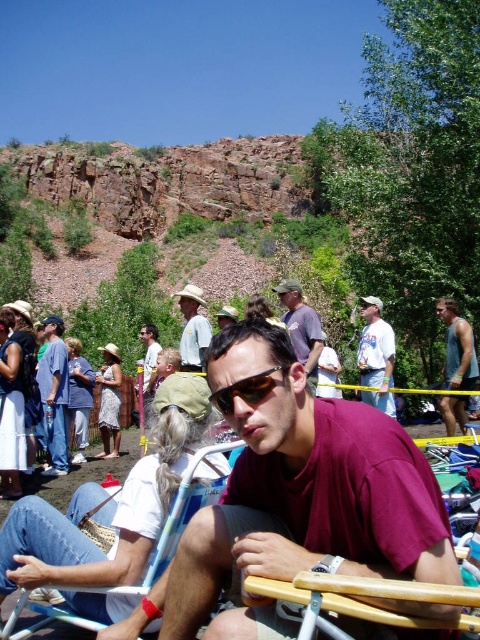
Between blue plastic beach chair at lower left and matte gray shirt at center, which one is positioned higher?

matte gray shirt at center

Is blue plastic beach chair at lower left taller than matte gray shirt at center?

Incorrect, blue plastic beach chair at lower left's height is not larger of matte gray shirt at center's.

Between point (233, 444) and point (292, 316), which one is positioned behind?

The point (292, 316) is more distant.

At what (x,y) coordinates should I click in order to perform the action: click on blue plastic beach chair at lower left. Please return your answer as a coordinate pair (x, y). The width and height of the screenshot is (480, 640). Looking at the image, I should click on (118, 586).

Consider the image. Is green tank top at right behind black plastic sunglasses at center?

Yes, green tank top at right is further from the viewer.

Between green tank top at right and black plastic sunglasses at center, which one appears on the right side from the viewer's perspective?

From the viewer's perspective, green tank top at right appears more on the right side.

Locate an element on the screen. green tank top at right is located at coordinates (457, 348).

Locate an element on the screen. This screenshot has width=480, height=640. green tank top at right is located at coordinates (457, 348).

Between maroon fabric shirt at center and matte brown hat at center, which one has more height?

With more height is maroon fabric shirt at center.

Is point (355, 416) positioned behind point (225, 317)?

No, it is not.

This screenshot has height=640, width=480. I want to click on maroon fabric shirt at center, so click(x=300, y=493).